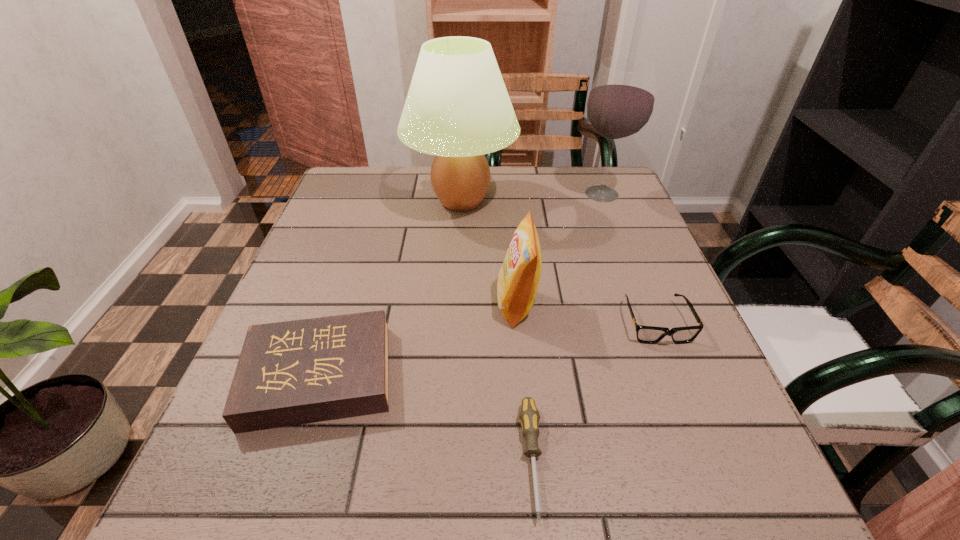
What are the coordinates of `unoccupied area between the sunglasses and the hardback book` in the screenshot? It's located at (488, 349).

In order to click on free area in between the alcohol and the sunglasses in this screenshot , I will do pos(629,258).

The height and width of the screenshot is (540, 960). Identify the location of vacant area between the shortest object and the lampshade. (496, 329).

Locate an element on the screen. The height and width of the screenshot is (540, 960). blank region between the crisp (potato chip) and the fifth tallest object is located at coordinates 587,314.

Find the location of a particular element. This screenshot has height=540, width=960. vacant area between the lampshade and the crisp (potato chip) is located at coordinates [489, 253].

Where is `vacant area that lies between the fifth tallest object and the alcohol`? The image size is (960, 540). vacant area that lies between the fifth tallest object and the alcohol is located at coordinates (629, 258).

Find the location of a particular element. vacant area that lies between the shortest object and the alcohol is located at coordinates (566, 326).

Find the location of a particular element. the closest object to the alcohol is located at coordinates (457, 108).

Identify the location of object that ranks as the fifth closest to the fourth tallest object. (620, 104).